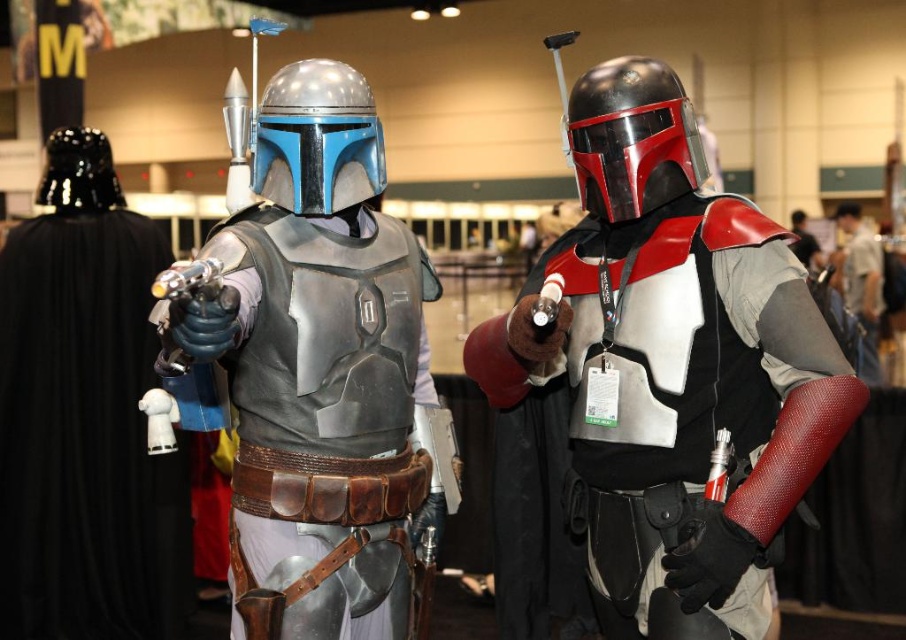
You are a photographer at a Star Wars convention and need to capture a clear shot of both the shiny black helmet at center and the black glossy helmet at left. Which helmet will appear taller in your photo?

The shiny black helmet at center will appear taller in the photo because it is much taller than the black glossy helmet at left.

You are a photographer at a Star Wars convention. You need to position two Mandalorian cosplayers so that their helmets don not block each other. The cosplayers are wearing the shiny black helmet at center and the black glossy helmet at left. Which helmet should be placed farther back to avoid blocking the other?

The shiny black helmet at center is bigger than the black glossy helmet at left, so placing the shiny black helmet at center farther back will help prevent it from blocking the smaller black glossy helmet at left.

You are a Star Wars fan attending a convention and want to take a photo of the two Mandalorian cosplayers. The first Mandalorian is at point (593, 385). You need to position yourself exactly halfway between them to frame the shot perfectly. What coordinate should you stand at?

The two Mandalorians are 6.92 feet apart. To find the midpoint between them, you would calculate the average of their coordinates. Since one is at (593, 385) and the other isn???t specified, the question lacks sufficient information to determine the exact coordinate.